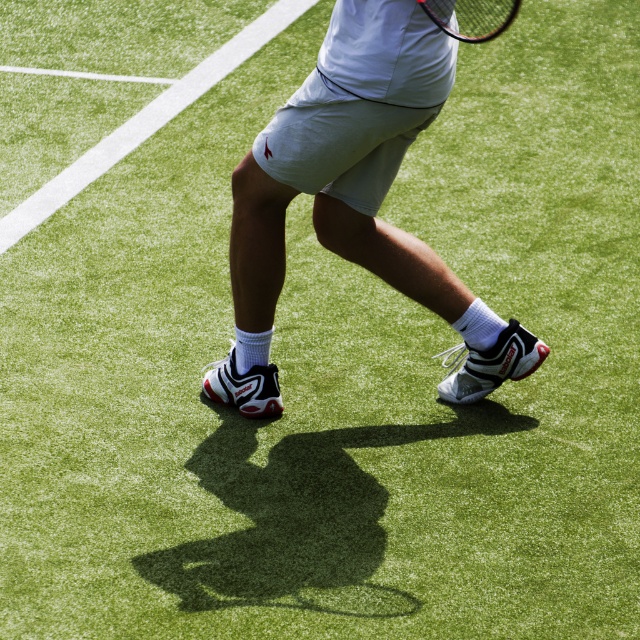
Is white mesh shorts at center smaller than black matte tennis racket at upper center?

Actually, white mesh shorts at center might be larger than black matte tennis racket at upper center.

Is white mesh shorts at center shorter than black matte tennis racket at upper center?

No.

I want to click on white mesh shorts at center, so click(353, 198).

Image resolution: width=640 pixels, height=640 pixels. What are the coordinates of `white mesh shorts at center` in the screenshot? It's located at coord(353,198).